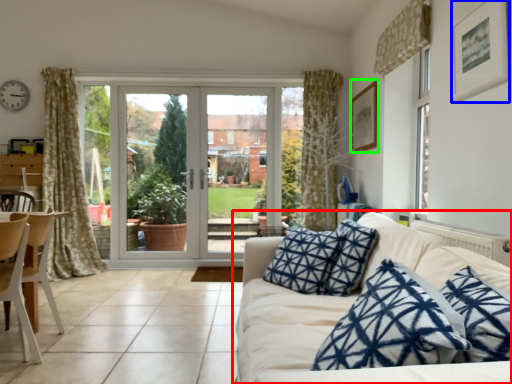
Question: Which is farther away from studio couch (highlighted by a red box)? picture frame (highlighted by a blue box) or picture frame (highlighted by a green box)?

Choices:
 (A) picture frame
 (B) picture frame

Answer: (B)